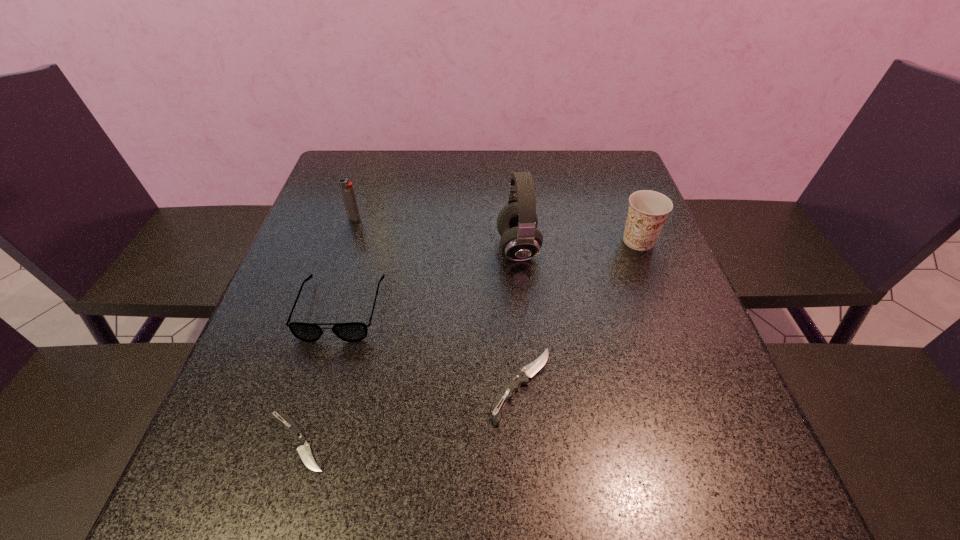
Find the location of a particular element. This screenshot has height=540, width=960. object that stands as the fourth closest to the tallest object is located at coordinates (347, 190).

Find the location of a particular element. This screenshot has width=960, height=540. vacant position in the image that satisfies the following two spatial constraints: 1. on the ear cups of the headset; 2. on the front-facing side of the spectacles is located at coordinates (523, 309).

What are the coordinates of `blank space that satisfies the following two spatial constraints: 1. on the front side of the farthest object; 2. on the left side of the rightmost object` in the screenshot? It's located at (347, 241).

Where is `vacant point that satisfies the following two spatial constraints: 1. on the front side of the left pocketknife; 2. on the left side of the farthest object`? vacant point that satisfies the following two spatial constraints: 1. on the front side of the left pocketknife; 2. on the left side of the farthest object is located at coordinates (281, 442).

This screenshot has width=960, height=540. What are the coordinates of `free space that satisfies the following two spatial constraints: 1. on the ear cups of the tallest object; 2. on the front side of the second shortest object` in the screenshot? It's located at (531, 386).

Where is `free space that satisfies the following two spatial constraints: 1. on the front side of the rightmost object; 2. on the ear cups of the headset`? This screenshot has height=540, width=960. free space that satisfies the following two spatial constraints: 1. on the front side of the rightmost object; 2. on the ear cups of the headset is located at coordinates tap(641, 248).